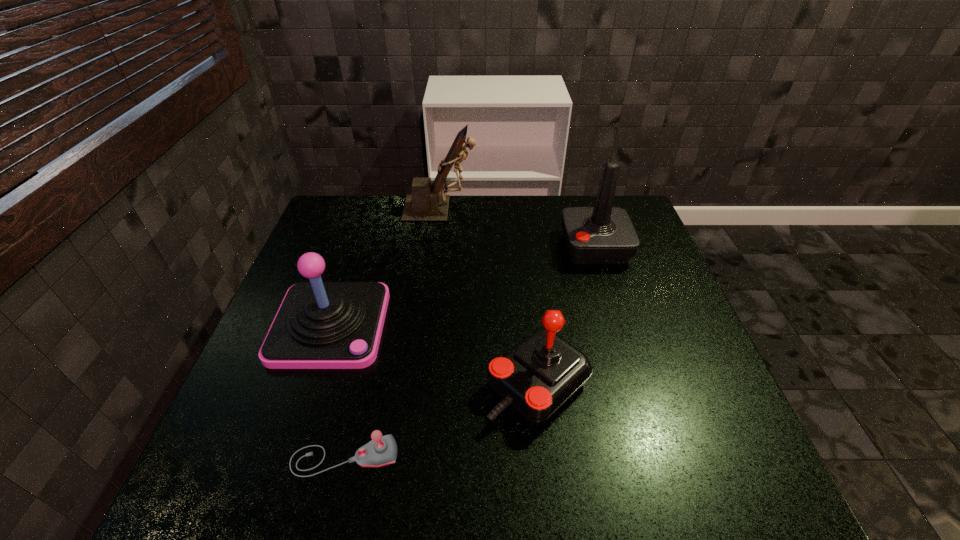
This screenshot has height=540, width=960. What are the coordinates of `free space at the near left corner of the desktop` in the screenshot? It's located at (200, 503).

Where is `vacant space at the near right corner of the desktop`? Image resolution: width=960 pixels, height=540 pixels. vacant space at the near right corner of the desktop is located at coordinates (739, 496).

Find the location of a particular element. This screenshot has height=540, width=960. free space between the second joystick from right to left and the figurine is located at coordinates (490, 296).

Where is `empty space between the fourth object from left to right and the rightmost object`? The height and width of the screenshot is (540, 960). empty space between the fourth object from left to right and the rightmost object is located at coordinates (566, 316).

The image size is (960, 540). In order to click on empty location between the fourth object from left to right and the farthest object in this screenshot , I will do `click(490, 296)`.

I want to click on empty space that is in between the nearest joystick and the fourth object from left to right, so click(x=442, y=421).

Identify the location of free area in between the nearest joystick and the farthest joystick. The height and width of the screenshot is (540, 960). (469, 352).

I want to click on object that is the nearest to the farthest object, so click(603, 234).

Locate an element on the screen. the closest object to the fourth object from left to right is located at coordinates (382, 450).

What are the coordinates of `joystick that is the third nearest to the shortest object` in the screenshot? It's located at (603, 234).